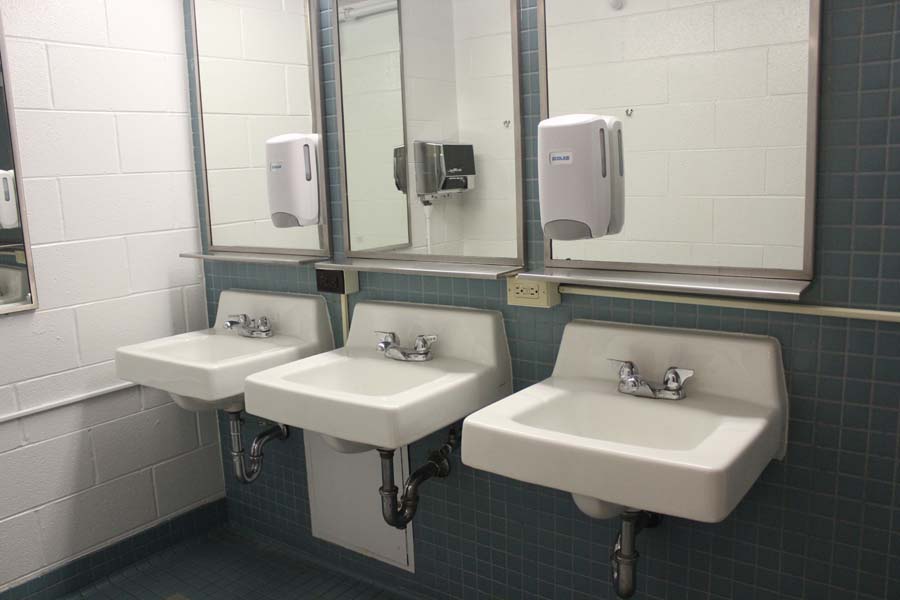
Where is `floor`? This screenshot has height=600, width=900. floor is located at coordinates (214, 588).